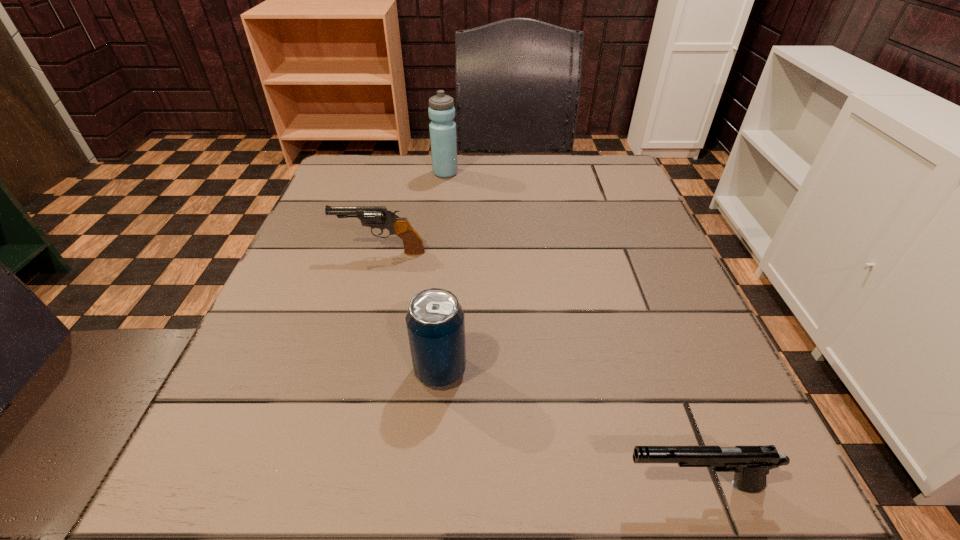
Locate an element on the screen. The image size is (960, 540). water bottle is located at coordinates (441, 111).

In order to click on the farthest object in this screenshot , I will do `click(441, 111)`.

Find the location of a particular element. Image resolution: width=960 pixels, height=540 pixels. the second tallest object is located at coordinates (435, 322).

The height and width of the screenshot is (540, 960). Identify the location of soda can. (435, 322).

Locate an element on the screen. Image resolution: width=960 pixels, height=540 pixels. the second shortest object is located at coordinates (379, 217).

You are a GUI agent. You are given a task and a screenshot of the screen. Output one action in this format:
    pyautogui.click(x=<x>, y=<y>)
    Task: Click on the farther gun
    Image resolution: width=960 pixels, height=540 pixels.
    Given the screenshot: What is the action you would take?
    pyautogui.click(x=379, y=217)

At what (x,y) coordinates should I click in order to perform the action: click on the nearer gun. Please return your answer as a coordinate pair (x, y). Image resolution: width=960 pixels, height=540 pixels. Looking at the image, I should click on (751, 464).

Locate an element on the screen. The image size is (960, 540). the rightmost object is located at coordinates (751, 464).

Locate an element on the screen. free point located 0.240m on the right of the farthest object is located at coordinates (553, 173).

Identify the location of vacant space located on the back of the second tallest object. point(451,230).